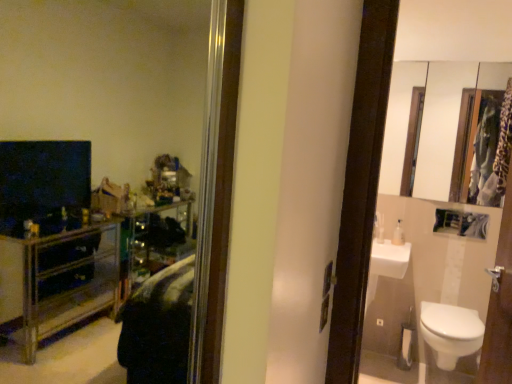
Describe the element at coordinates (398, 234) in the screenshot. I see `clear plastic bottle at right` at that location.

From the picture: What is the approximate width of white glossy toilet at lower right?

It is 53.12 centimeters.

Where is `clear plastic bottle at right`? Image resolution: width=512 pixels, height=384 pixels. clear plastic bottle at right is located at coordinates (398, 234).

Is clear plastic bottle at right located outside white glossy mirror at upper right?

Indeed, clear plastic bottle at right is completely outside white glossy mirror at upper right.

Is clear plastic bottle at right wider or thinner than white glossy mirror at upper right?

Considering their sizes, clear plastic bottle at right looks broader than white glossy mirror at upper right.

In the scene shown: From a real-world perspective, is clear plastic bottle at right under white glossy mirror at upper right?

Indeed, from a real-world perspective, clear plastic bottle at right is positioned beneath white glossy mirror at upper right.

From a real-world perspective, is white glossy toilet at lower right located higher than white glossy mirror at upper right?

No, from a real-world perspective, white glossy toilet at lower right is not on top of white glossy mirror at upper right.

In terms of size, does white glossy toilet at lower right appear bigger or smaller than white glossy mirror at upper right?

In the image, white glossy toilet at lower right appears to be larger than white glossy mirror at upper right.

Considering their positions, is white glossy toilet at lower right located in front of or behind white glossy mirror at upper right?

In the image, white glossy toilet at lower right appears in front of white glossy mirror at upper right.

Considering the relative sizes of white glossy toilet at lower right and white glossy mirror at upper right in the image provided, is white glossy toilet at lower right shorter than white glossy mirror at upper right?

Correct, white glossy toilet at lower right is not as tall as white glossy mirror at upper right.

Is clear plastic bottle at right touching white glossy toilet at lower right?

clear plastic bottle at right is not next to white glossy toilet at lower right, and they're not touching.

From a real-world perspective, is clear plastic bottle at right on white glossy toilet at lower right?

Yes, from a real-world perspective, clear plastic bottle at right is on top of white glossy toilet at lower right.

The height and width of the screenshot is (384, 512). I want to click on toiletry above the white glossy toilet at lower right (from the image's perspective), so click(x=398, y=234).

From the image's perspective, which object appears higher, clear plastic bottle at right or white glossy toilet at lower right?

clear plastic bottle at right is shown above in the image.

From a real-world perspective, which object stands above the other?

white glossy mirror at upper right is physically above.

Considering the relative sizes of white glossy mirror at upper right and clear plastic bottle at right in the image provided, is white glossy mirror at upper right smaller than clear plastic bottle at right?

Actually, white glossy mirror at upper right might be larger than clear plastic bottle at right.

Between white glossy mirror at upper right and clear plastic bottle at right, which one appears on the left side from the viewer's perspective?

Positioned to the left is clear plastic bottle at right.

Is white glossy mirror at upper right not within clear plastic bottle at right?

Result: white glossy mirror at upper right is positioned outside clear plastic bottle at right.

Can you tell me how much white glossy toilet at lower right and clear plastic bottle at right differ in facing direction?

1.54 degrees separate the facing orientations of white glossy toilet at lower right and clear plastic bottle at right.

From a real-world perspective, is white glossy toilet at lower right positioned above or below clear plastic bottle at right?

white glossy toilet at lower right is below clear plastic bottle at right.

From the image's perspective, would you say white glossy toilet at lower right is shown under clear plastic bottle at right?

Yes, from the image's perspective, white glossy toilet at lower right is below clear plastic bottle at right.

Is clear plastic bottle at right at the back of white glossy toilet at lower right?

No, white glossy toilet at lower right's orientation is not away from clear plastic bottle at right.

Is white glossy mirror at upper right touching white glossy toilet at lower right?

No.

From a real-world perspective, does white glossy mirror at upper right stand above white glossy toilet at lower right?

Yes.

Does white glossy mirror at upper right have a lesser height compared to white glossy toilet at lower right?

Incorrect, the height of white glossy mirror at upper right does not fall short of that of white glossy toilet at lower right.

Is white glossy mirror at upper right aimed at white glossy toilet at lower right?

No, white glossy mirror at upper right is not oriented towards white glossy toilet at lower right.

The image size is (512, 384). Identify the location of mirror to the right of clear plastic bottle at right. (398, 122).

Where is `mirror above the white glossy toilet at lower right (from the image's perspective)`? This screenshot has height=384, width=512. mirror above the white glossy toilet at lower right (from the image's perspective) is located at coordinates (398, 122).

Which object lies further to the anchor point white glossy toilet at lower right, clear plastic bottle at right or white glossy mirror at upper right?

white glossy mirror at upper right is positioned further to the anchor white glossy toilet at lower right.

When comparing their distances from white glossy mirror at upper right, does white glossy toilet at lower right or clear plastic bottle at right seem closer?

Based on the image, clear plastic bottle at right appears to be nearer to white glossy mirror at upper right.

Which object lies further to the anchor point white glossy toilet at lower right, white glossy mirror at upper right or clear plastic bottle at right?

white glossy mirror at upper right is further to white glossy toilet at lower right.

Which object lies further to the anchor point white glossy mirror at upper right, clear plastic bottle at right or white glossy toilet at lower right?

white glossy toilet at lower right is positioned further to the anchor white glossy mirror at upper right.

Which object lies further to the anchor point clear plastic bottle at right, white glossy mirror at upper right or white glossy toilet at lower right?

white glossy mirror at upper right lies further to clear plastic bottle at right than the other object.

When comparing their distances from clear plastic bottle at right, does white glossy toilet at lower right or white glossy mirror at upper right seem further?

The object further to clear plastic bottle at right is white glossy mirror at upper right.

Locate an element on the screen. toiletry between white glossy mirror at upper right and white glossy toilet at lower right in the up-down direction is located at coordinates (398, 234).